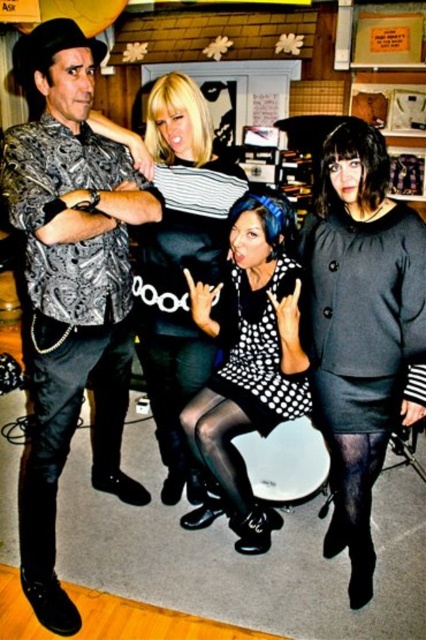
Question: Does matte black shirt at left appear under black matte dress at center?

Choices:
 (A) yes
 (B) no

Answer: (A)

Question: Which point is farther to the camera?

Choices:
 (A) (37, 401)
 (B) (218, 476)
 (C) (100, 380)
 (D) (339, 257)

Answer: (C)

Question: Observing the image, what is the correct spatial positioning of matte black shirt at left in reference to polka dot dress at center?

Choices:
 (A) below
 (B) above

Answer: (B)

Question: Can you confirm if matte black shirt at left is thinner than matte black dress at center?

Choices:
 (A) no
 (B) yes

Answer: (A)

Question: Which object appears farthest from the camera in this image?

Choices:
 (A) matte black dress at center
 (B) black dotted dress at center
 (C) polka dot dress at center

Answer: (B)

Question: Which is nearer to the black leather pants at lower left?

Choices:
 (A) matte black shirt at left
 (B) matte black dress at center

Answer: (A)